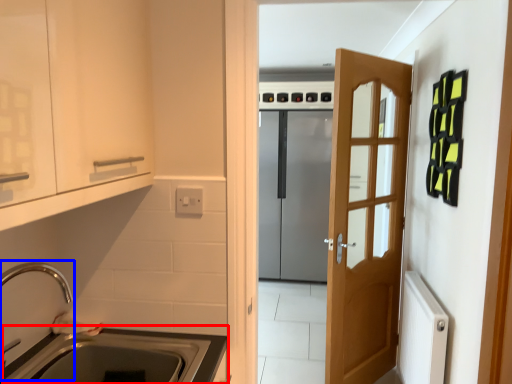
Question: Among these objects, which one is nearest to the camera, counter top (highlighted by a red box) or faucet (highlighted by a blue box)?

Choices:
 (A) counter top
 (B) faucet

Answer: (B)